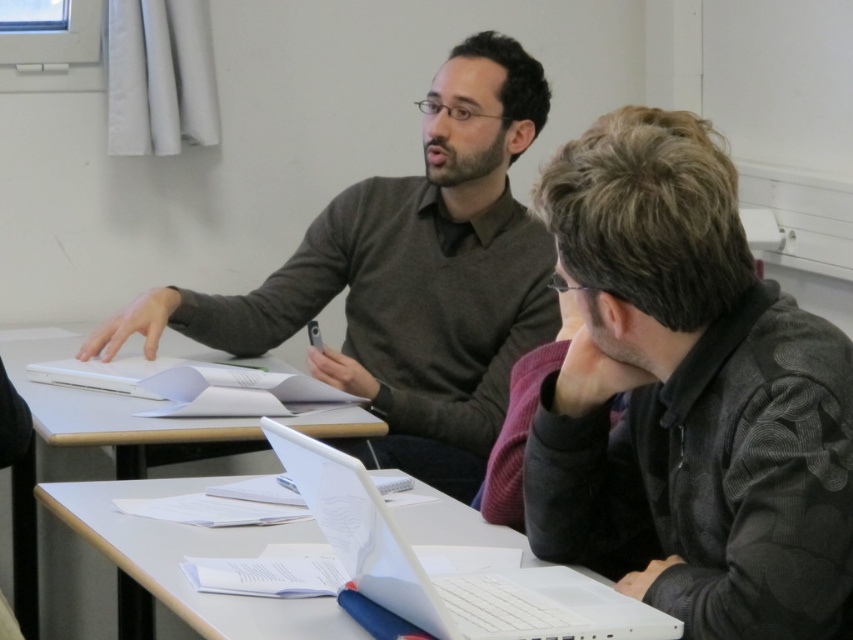
You are a student entering the classroom and need to place your backpack on the white plastic table at center. However, you notice the dark gray sweater at center is already on the table. Can you still place your backpack there without moving the sweater?

The dark gray sweater at center is located above white plastic table at center, meaning it is currently on the table. Therefore, you cannot place your backpack there without moving the sweater.

In the scene shown: You are a student who wants to place a notebook on the white plastic table at center without it being covered by anything. Is the dark gray textured jacket at center currently blocking that area?

The dark gray textured jacket at center is positioned over white plastic table at center, so placing the notebook there would require moving the jacket first.

You are a student entering the classroom and need to sit at the white plastic table at center. Which side of the table should you choose to sit on if you want to be on the opposite side of the dark gray textured jacket at center?

You should sit on the left side of the white plastic table at center because the dark gray textured jacket at center is to the right of the table, so the opposite side would be the left.